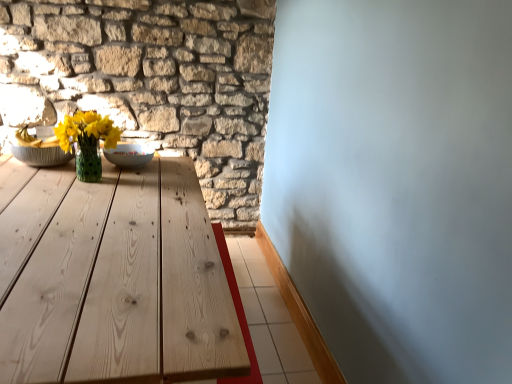
Question: From a real-world perspective, is matte green vase at center-left below white glossy bowl at center?

Choices:
 (A) no
 (B) yes

Answer: (A)

Question: Is white glossy bowl at center at the back of matte green vase at center-left?

Choices:
 (A) yes
 (B) no

Answer: (A)

Question: Does matte green vase at center-left come in front of white glossy bowl at center?

Choices:
 (A) yes
 (B) no

Answer: (A)

Question: Are matte green vase at center-left and white glossy bowl at center making contact?

Choices:
 (A) no
 (B) yes

Answer: (A)

Question: From a real-world perspective, is matte green vase at center-left over white glossy bowl at center?

Choices:
 (A) yes
 (B) no

Answer: (A)

Question: Considering the relative sizes of matte green vase at center-left and white glossy bowl at center in the image provided, is matte green vase at center-left smaller than white glossy bowl at center?

Choices:
 (A) no
 (B) yes

Answer: (A)

Question: Is natural stone wall at upper left facing away from matte green vase at center-left?

Choices:
 (A) no
 (B) yes

Answer: (B)

Question: From the image's perspective, is natural stone wall at upper left on matte green vase at center-left?

Choices:
 (A) yes
 (B) no

Answer: (A)

Question: Is matte green vase at center-left inside natural stone wall at upper left?

Choices:
 (A) yes
 (B) no

Answer: (B)

Question: Could you tell me if natural stone wall at upper left is facing matte green vase at center-left?

Choices:
 (A) yes
 (B) no

Answer: (A)

Question: Is natural stone wall at upper left not inside matte green vase at center-left?

Choices:
 (A) yes
 (B) no

Answer: (A)

Question: Does natural stone wall at upper left have a smaller size compared to matte green vase at center-left?

Choices:
 (A) yes
 (B) no

Answer: (B)

Question: Would you consider white glossy bowl at center to be distant from matte green vase at center-left?

Choices:
 (A) no
 (B) yes

Answer: (A)